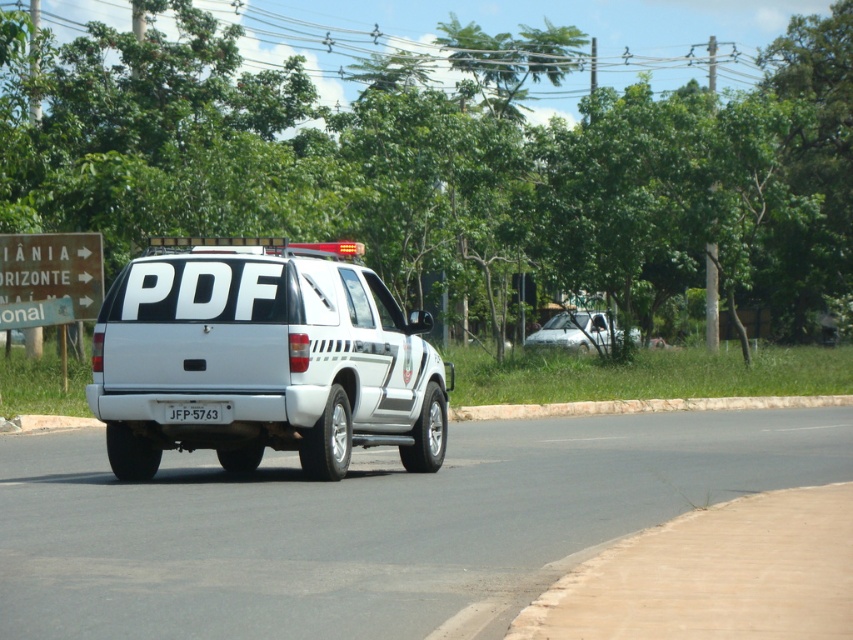
Is point (61, 253) in front of point (175, 422)?

That is False.

Which is more to the left, green wooden sign at upper left or white plastic license plate at center?

green wooden sign at upper left is more to the left.

Identify the location of green wooden sign at upper left. (49, 278).

Where is `green wooden sign at upper left`? green wooden sign at upper left is located at coordinates (49, 278).

Which is more to the left, white matte suv at center or green wooden sign at upper left?

From the viewer's perspective, green wooden sign at upper left appears more on the left side.

This screenshot has height=640, width=853. What are the coordinates of `white matte suv at center` in the screenshot? It's located at (263, 358).

Locate an element on the screen. The image size is (853, 640). white matte suv at center is located at coordinates (263, 358).

Is point (404, 387) less distant than point (212, 417)?

That is False.

The height and width of the screenshot is (640, 853). What do you see at coordinates (263, 358) in the screenshot?
I see `white matte suv at center` at bounding box center [263, 358].

Find the location of a particular element. white matte suv at center is located at coordinates (263, 358).